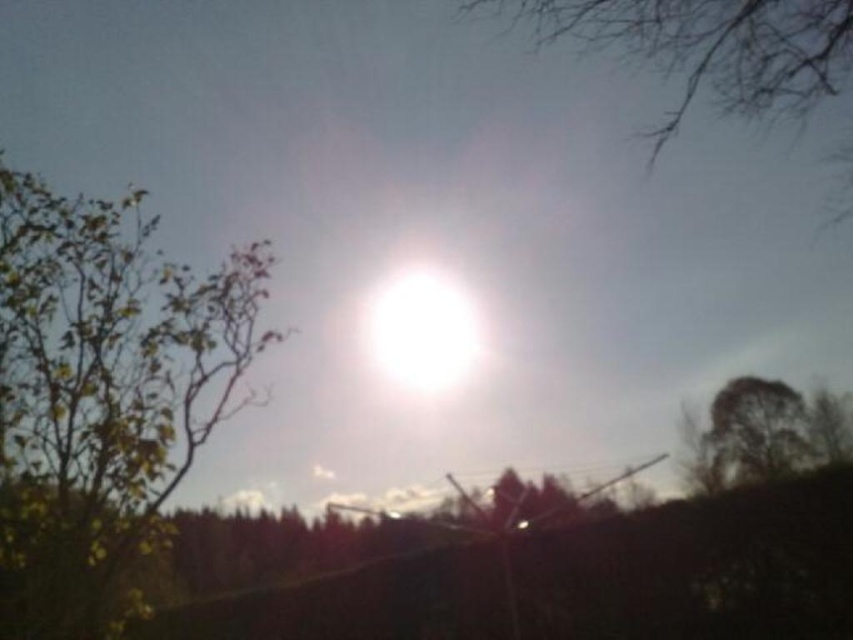
You are standing in the scene and want to take a photo of the sun. To avoid the green leafy tree at left blocking the sun in your photo, should you move to the left or right?

The green leafy tree at left is located at point (102, 394), which is to the left side of the frame. To avoid blocking the sun centrally, move to the right side of the frame.

Looking at this image, you are standing in the scene and want to walk towards the sun. Which object will you pass first, the green leafy tree at left or the bare branches at upper right?

The green leafy tree at left is closer to the viewer than the bare branches at upper right, so you will pass the green leafy tree at left first when walking towards the sun.